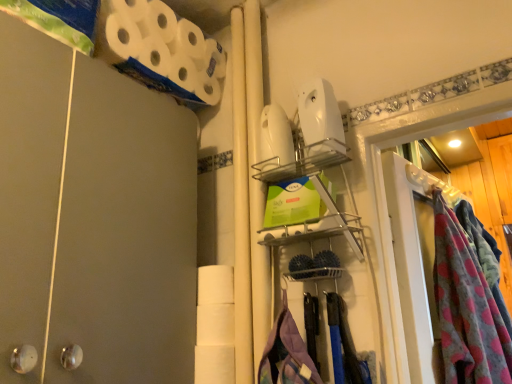
Question: Considering the relative sizes of clear plastic glass door at right and white matte toilet paper at upper left, placed as the 2th toilet paper when sorted from bottom to top, in the image provided, is clear plastic glass door at right shorter than white matte toilet paper at upper left, placed as the 2th toilet paper when sorted from bottom to top,?

Choices:
 (A) yes
 (B) no

Answer: (B)

Question: Does clear plastic glass door at right have a larger size compared to white matte toilet paper at upper left, placed as the 2th toilet paper when sorted from bottom to top?

Choices:
 (A) yes
 (B) no

Answer: (A)

Question: Is clear plastic glass door at right looking in the opposite direction of white matte toilet paper at upper left, marked as the 1th toilet paper in a top-to-bottom arrangement?

Choices:
 (A) yes
 (B) no

Answer: (B)

Question: Does clear plastic glass door at right have a lesser width compared to white matte toilet paper at upper left, placed as the 2th toilet paper when sorted from bottom to top?

Choices:
 (A) yes
 (B) no

Answer: (A)

Question: Is clear plastic glass door at right oriented towards white matte toilet paper at upper left, marked as the 1th toilet paper in a top-to-bottom arrangement?

Choices:
 (A) yes
 (B) no

Answer: (B)

Question: From a real-world perspective, is clear plastic glass door at right under white matte toilet paper at upper left, placed as the 2th toilet paper when sorted from bottom to top?

Choices:
 (A) no
 (B) yes

Answer: (B)

Question: Is fluffy pink blanket at right facing away from clear plastic glass door at right?

Choices:
 (A) no
 (B) yes

Answer: (B)

Question: Considering the relative sizes of fluffy pink blanket at right and clear plastic glass door at right in the image provided, is fluffy pink blanket at right bigger than clear plastic glass door at right?

Choices:
 (A) no
 (B) yes

Answer: (B)

Question: Does fluffy pink blanket at right touch clear plastic glass door at right?

Choices:
 (A) yes
 (B) no

Answer: (B)

Question: From a real-world perspective, is fluffy pink blanket at right located beneath clear plastic glass door at right?

Choices:
 (A) no
 (B) yes

Answer: (B)

Question: Does fluffy pink blanket at right have a greater width compared to clear plastic glass door at right?

Choices:
 (A) no
 (B) yes

Answer: (B)

Question: From the image's perspective, would you say fluffy pink blanket at right is positioned over clear plastic glass door at right?

Choices:
 (A) yes
 (B) no

Answer: (A)

Question: Does white matte toilet paper at center, marked as the 1th toilet paper in a bottom-to-top arrangement, have a lesser width compared to fluffy pink blanket at right?

Choices:
 (A) yes
 (B) no

Answer: (A)